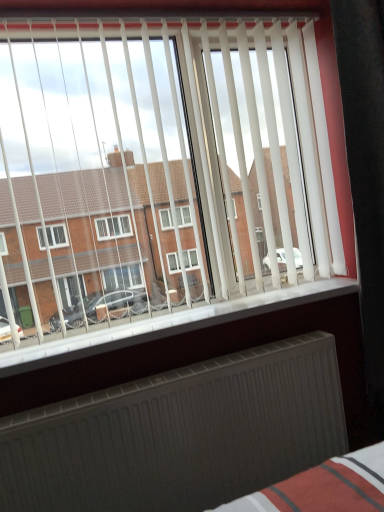
Question: Considering the relative positions of dark gray metallic radiator at bottom and white plastic window sill at lower center in the image provided, is dark gray metallic radiator at bottom to the left or to the right of white plastic window sill at lower center?

Choices:
 (A) left
 (B) right

Answer: (A)

Question: From the image's perspective, is dark gray metallic radiator at bottom above or below white plastic window sill at lower center?

Choices:
 (A) above
 (B) below

Answer: (B)

Question: Is dark gray metallic radiator at bottom spatially inside white plastic window sill at lower center, or outside of it?

Choices:
 (A) outside
 (B) inside

Answer: (A)

Question: Is white plastic window sill at lower center spatially inside dark gray metallic radiator at bottom, or outside of it?

Choices:
 (A) inside
 (B) outside

Answer: (B)

Question: From the image's perspective, relative to dark gray metallic radiator at bottom, is white plastic window sill at lower center above or below?

Choices:
 (A) above
 (B) below

Answer: (A)

Question: Considering the positions of white plastic window sill at lower center and dark gray metallic radiator at bottom in the image, is white plastic window sill at lower center bigger or smaller than dark gray metallic radiator at bottom?

Choices:
 (A) big
 (B) small

Answer: (B)

Question: From a real-world perspective, is white plastic window sill at lower center physically located above or below dark gray metallic radiator at bottom?

Choices:
 (A) below
 (B) above

Answer: (B)